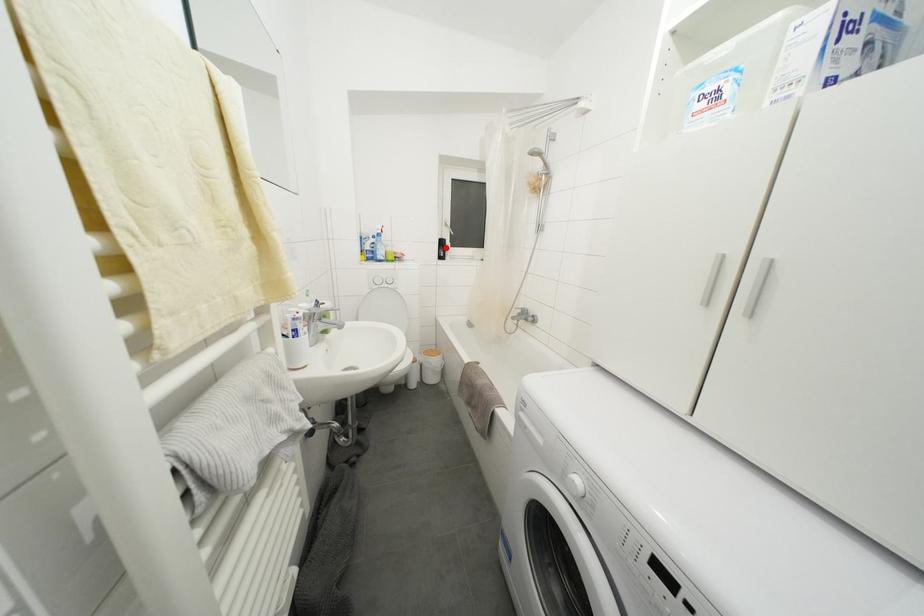
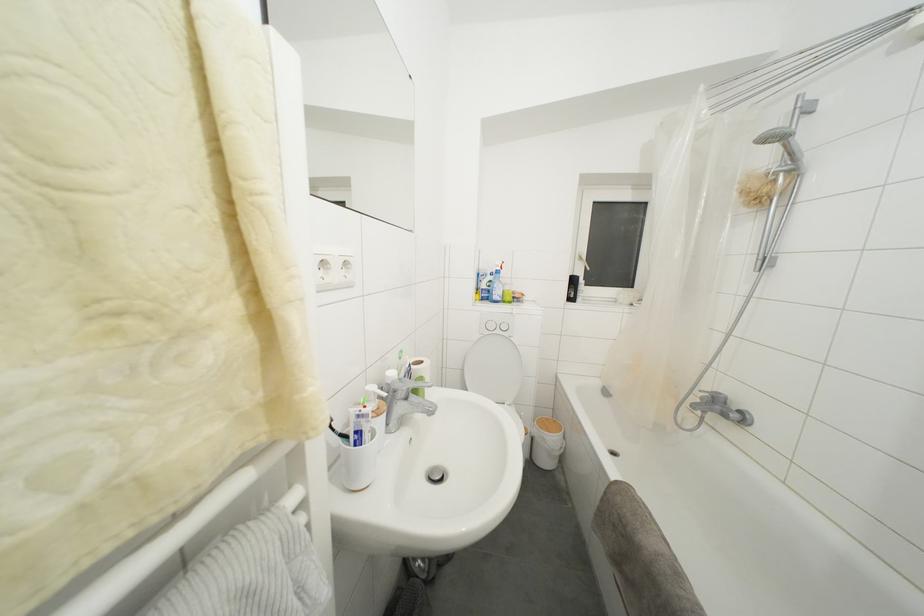
Find the pixel in the second image that matches the highlighted location in the first image.

(578, 286)